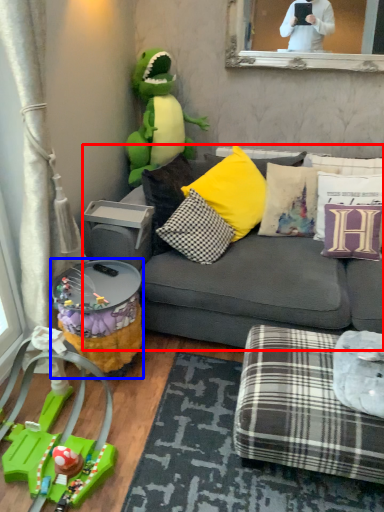
Question: Which of the following is the closest to the observer, studio couch (highlighted by a red box) or side table (highlighted by a blue box)?

Choices:
 (A) studio couch
 (B) side table

Answer: (A)